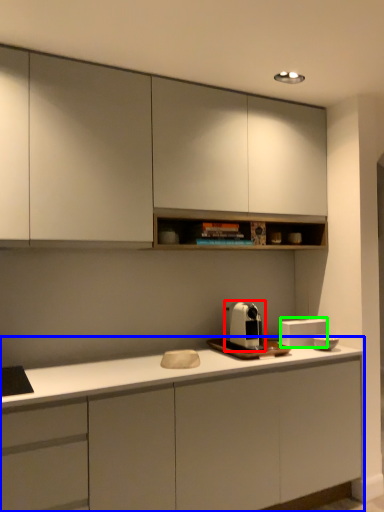
Question: Estimate the real-world distances between objects in this image. Which object is closer to home appliance (highlighted by a red box), cabinetry (highlighted by a blue box) or appliance (highlighted by a green box)?

Choices:
 (A) cabinetry
 (B) appliance

Answer: (B)